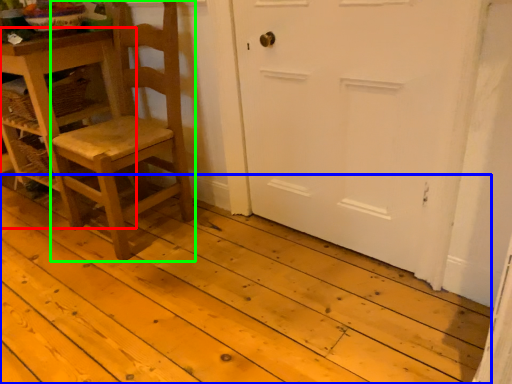
Question: Estimate the real-world distances between objects in this image. Which object is closer to table (highlighted by a red box), plank (highlighted by a blue box) or chair (highlighted by a green box)?

Choices:
 (A) plank
 (B) chair

Answer: (B)